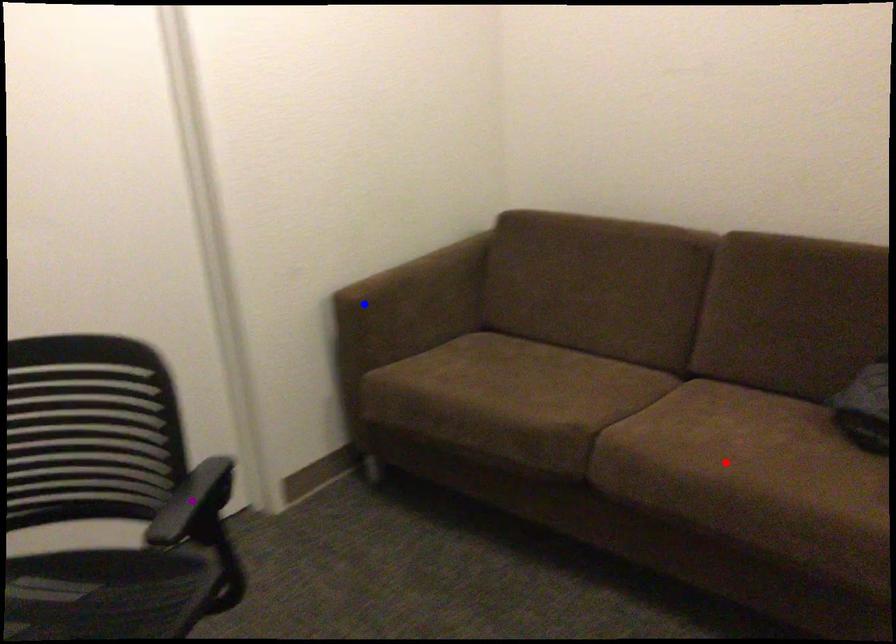
Order these from nearest to farthest:
A) red point
B) blue point
C) purple point

purple point
red point
blue point